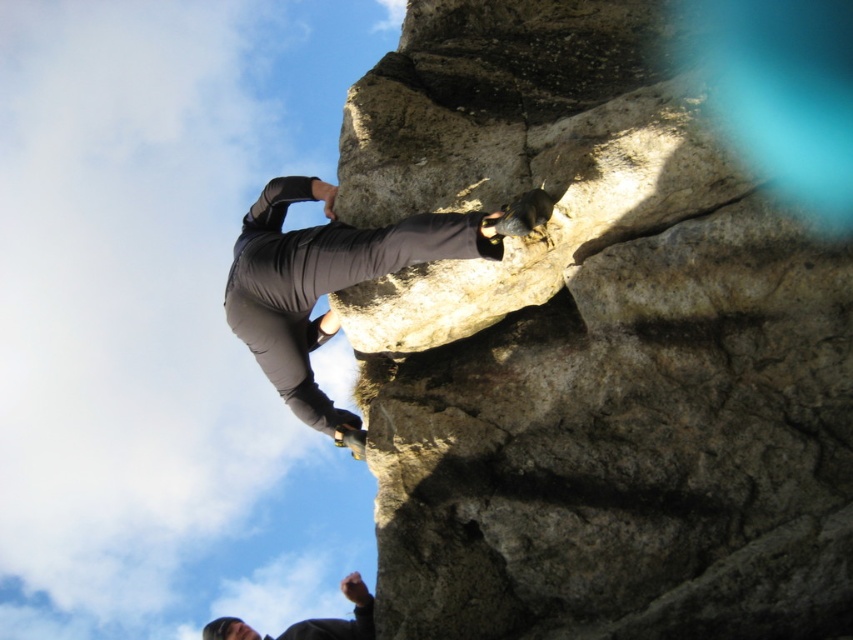
Question: Which object is farther from the camera taking this photo?

Choices:
 (A) gray matte pants at center
 (B) rough stone cliff at center
 (C) dark gray fabric pants at upper center

Answer: (A)

Question: Is rough stone cliff at center positioned at the back of gray matte pants at center?

Choices:
 (A) no
 (B) yes

Answer: (A)

Question: Is rough stone cliff at center smaller than gray matte pants at center?

Choices:
 (A) yes
 (B) no

Answer: (B)

Question: Which point is closer to the camera?

Choices:
 (A) gray matte pants at center
 (B) dark gray fabric pants at upper center
 (C) rough stone cliff at center

Answer: (C)

Question: Which object is the closest to the dark gray fabric pants at upper center?

Choices:
 (A) rough stone cliff at center
 (B) gray matte pants at center

Answer: (A)

Question: In this image, where is gray matte pants at center located relative to dark gray fabric pants at upper center?

Choices:
 (A) left
 (B) right

Answer: (B)